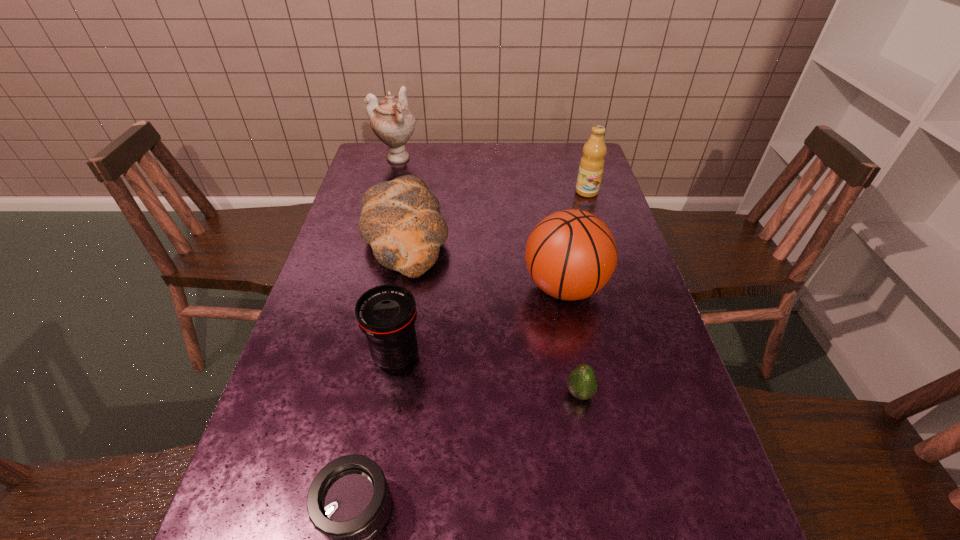
Find the location of a particular element. This screenshot has height=540, width=960. the farthest object is located at coordinates (392, 122).

You are a GUI agent. You are given a task and a screenshot of the screen. Output one action in this format:
    pyautogui.click(x=<x>, y=<y>)
    Task: Click on the olive oil
    The width and height of the screenshot is (960, 540).
    Given the screenshot: What is the action you would take?
    pyautogui.click(x=591, y=167)

The width and height of the screenshot is (960, 540). I want to click on basketball, so click(571, 254).

The height and width of the screenshot is (540, 960). What are the coordinates of `the farther telephoto lens` in the screenshot? It's located at (386, 314).

The width and height of the screenshot is (960, 540). Identify the location of the taller telephoto lens. (386, 314).

Find the location of a particular element. This screenshot has width=960, height=540. the fifth tallest object is located at coordinates (400, 219).

Where is `avocado`? avocado is located at coordinates (582, 382).

At what (x,y) coordinates should I click in order to perform the action: click on vacant space located 0.320m on the right of the urn. Please return your answer as a coordinate pair (x, y). This screenshot has width=960, height=540. Looking at the image, I should click on (507, 159).

What are the coordinates of `vacant space located 0.350m on the label of the olive oil` in the screenshot? It's located at (612, 273).

Where is `free spot located 0.350m on the front of the basketball`? free spot located 0.350m on the front of the basketball is located at coordinates (599, 465).